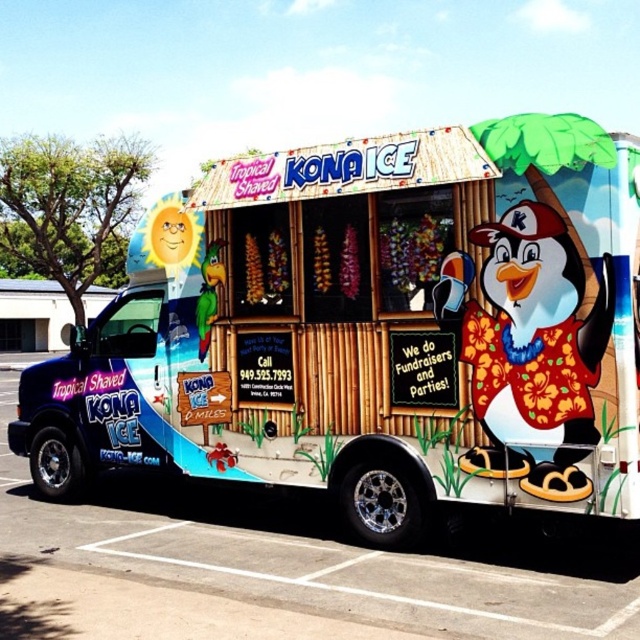
Question: Among these points, which one is farthest from the camera?

Choices:
 (A) (490, 125)
 (B) (321, 596)

Answer: (A)

Question: Which object is farther from the camera taking this photo?

Choices:
 (A) matte blue truck at center
 (B) blue painted asphalt at lower center

Answer: (A)

Question: Does matte blue truck at center appear on the right side of blue painted asphalt at lower center?

Choices:
 (A) no
 (B) yes

Answer: (A)

Question: Where is matte blue truck at center located in relation to blue painted asphalt at lower center in the image?

Choices:
 (A) above
 (B) below

Answer: (A)

Question: Can you confirm if matte blue truck at center is smaller than blue painted asphalt at lower center?

Choices:
 (A) yes
 (B) no

Answer: (B)